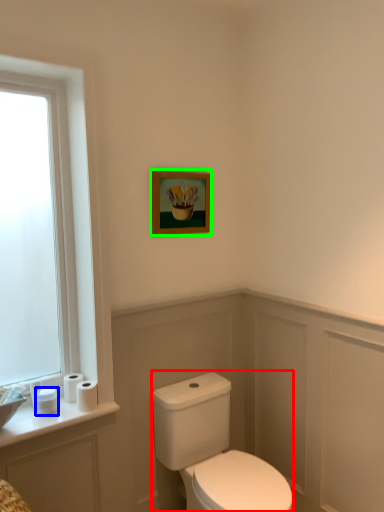
Question: Which object is positioned farthest from porcelain (highlighted by a red box)? Select from toilet paper (highlighted by a blue box) and picture frame (highlighted by a green box).

Choices:
 (A) toilet paper
 (B) picture frame

Answer: (B)